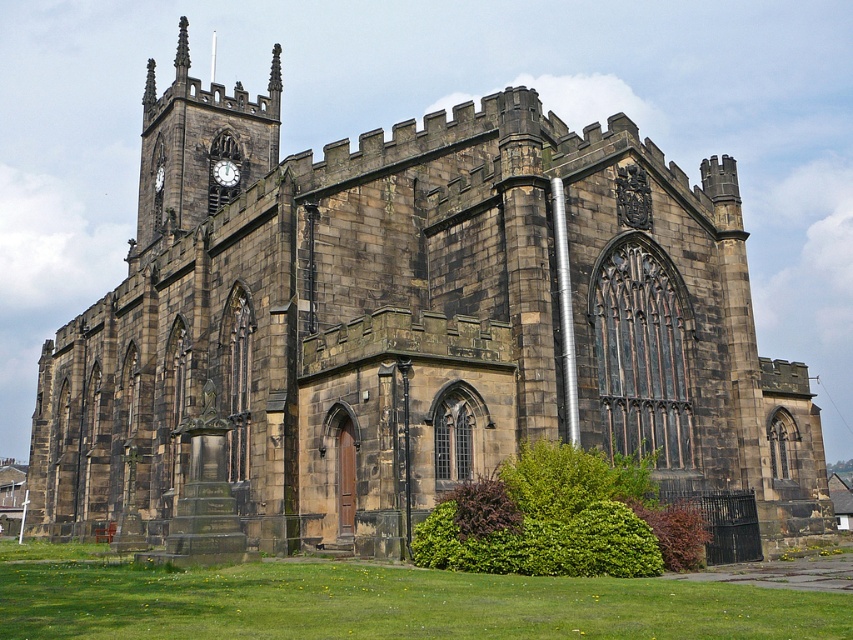
Who is more forward, (529, 522) or (223, 170)?

Positioned in front is point (529, 522).

Does green leafy bush at lower center have a greater width compared to matte black clock at upper left?

Correct, the width of green leafy bush at lower center exceeds that of matte black clock at upper left.

You are a GUI agent. You are given a task and a screenshot of the screen. Output one action in this format:
    pyautogui.click(x=<x>, y=<y>)
    Task: Click on the green leafy bush at lower center
    
    Given the screenshot: What is the action you would take?
    click(560, 518)

This screenshot has height=640, width=853. In order to click on green leafy bush at lower center in this screenshot , I will do `click(560, 518)`.